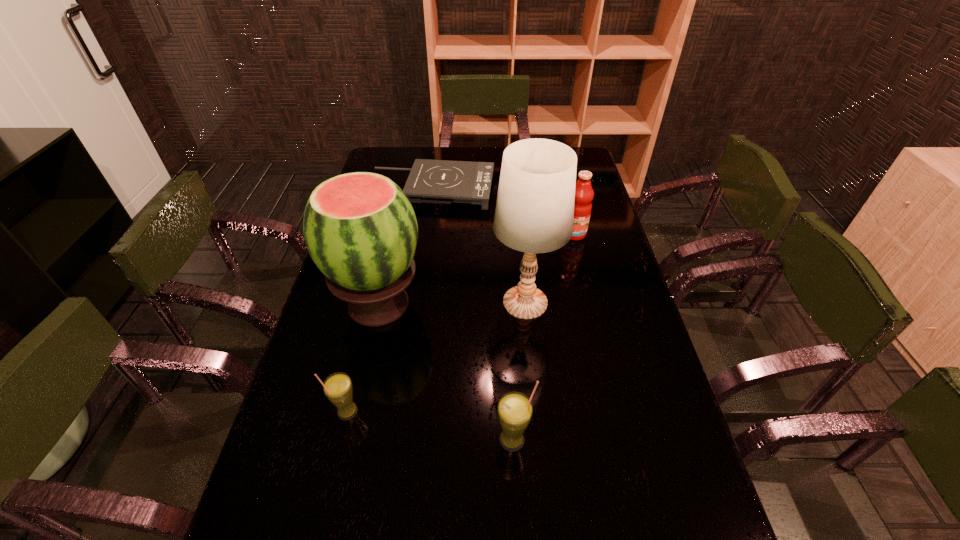
At what (x,y) coordinates should I click in order to perform the action: click on object that is at the right edge. Please return your answer as a coordinate pair (x, y). The image size is (960, 540). Looking at the image, I should click on (584, 194).

Find the location of a particular element. Image resolution: width=960 pixels, height=540 pixels. object that is at the far left corner is located at coordinates (430, 181).

Identify the location of vacant region at the left edge of the desktop. (328, 319).

Find the location of a particular element. Image resolution: width=960 pixels, height=540 pixels. free spot at the right edge of the desktop is located at coordinates (606, 330).

In the image, there is a desktop. Where is `vacant space at the far left corner`? The width and height of the screenshot is (960, 540). vacant space at the far left corner is located at coordinates (401, 166).

Identify the location of vacant space at the far right corner of the desktop. Image resolution: width=960 pixels, height=540 pixels. pyautogui.click(x=588, y=166).

Locate an element on the screen. The image size is (960, 540). empty location between the farthest object and the tallest object is located at coordinates (479, 246).

Locate an element on the screen. This screenshot has width=960, height=540. free space between the nearer straw for drinking and the hotplate is located at coordinates (473, 314).

Locate an element on the screen. This screenshot has height=540, width=960. free space between the shorter straw for drinking and the watermelon is located at coordinates (363, 358).

The image size is (960, 540). I want to click on free space between the taller straw for drinking and the hotplate, so click(x=473, y=314).